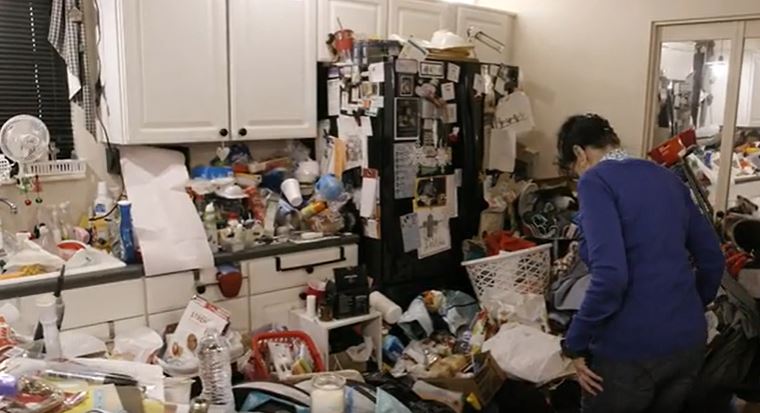
Where is `styrofoam cup`? The image size is (760, 413). styrofoam cup is located at coordinates (296, 190).